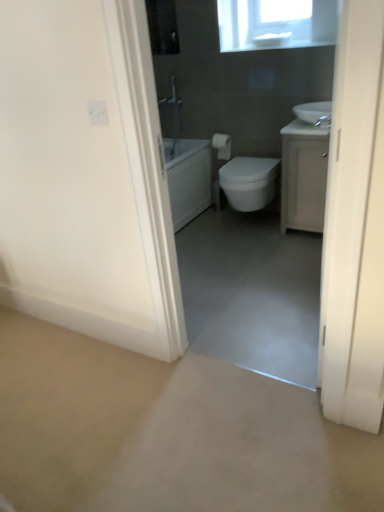
Question: Is white matte toilet paper at center wider than white glossy bidet at center?

Choices:
 (A) no
 (B) yes

Answer: (A)

Question: From a real-world perspective, is white matte toilet paper at center positioned over white glossy bidet at center based on gravity?

Choices:
 (A) no
 (B) yes

Answer: (B)

Question: Would you say white matte toilet paper at center contains white glossy bidet at center?

Choices:
 (A) no
 (B) yes

Answer: (A)

Question: Is white matte toilet paper at center at the right side of white glossy bidet at center?

Choices:
 (A) yes
 (B) no

Answer: (B)

Question: Considering the relative sizes of white matte toilet paper at center and white glossy bidet at center in the image provided, is white matte toilet paper at center thinner than white glossy bidet at center?

Choices:
 (A) no
 (B) yes

Answer: (B)

Question: Are white matte toilet paper at center and white glossy bidet at center far apart?

Choices:
 (A) no
 (B) yes

Answer: (A)

Question: Is white glossy bidet at center closer to camera compared to white matte toilet paper at center?

Choices:
 (A) yes
 (B) no

Answer: (A)

Question: Is white matte toilet paper at center a part of white glossy bidet at center?

Choices:
 (A) yes
 (B) no

Answer: (B)

Question: Can you confirm if white glossy bidet at center is taller than white matte toilet paper at center?

Choices:
 (A) yes
 (B) no

Answer: (A)

Question: Considering the relative sizes of white glossy bidet at center and white matte toilet paper at center in the image provided, is white glossy bidet at center shorter than white matte toilet paper at center?

Choices:
 (A) no
 (B) yes

Answer: (A)

Question: Considering the relative sizes of white glossy bidet at center and white matte toilet paper at center in the image provided, is white glossy bidet at center wider than white matte toilet paper at center?

Choices:
 (A) yes
 (B) no

Answer: (A)

Question: Is white glossy bidet at center smaller than white matte toilet paper at center?

Choices:
 (A) no
 (B) yes

Answer: (A)

Question: Does white matte toilet paper at center turn towards smooth concrete floor at center?

Choices:
 (A) yes
 (B) no

Answer: (A)